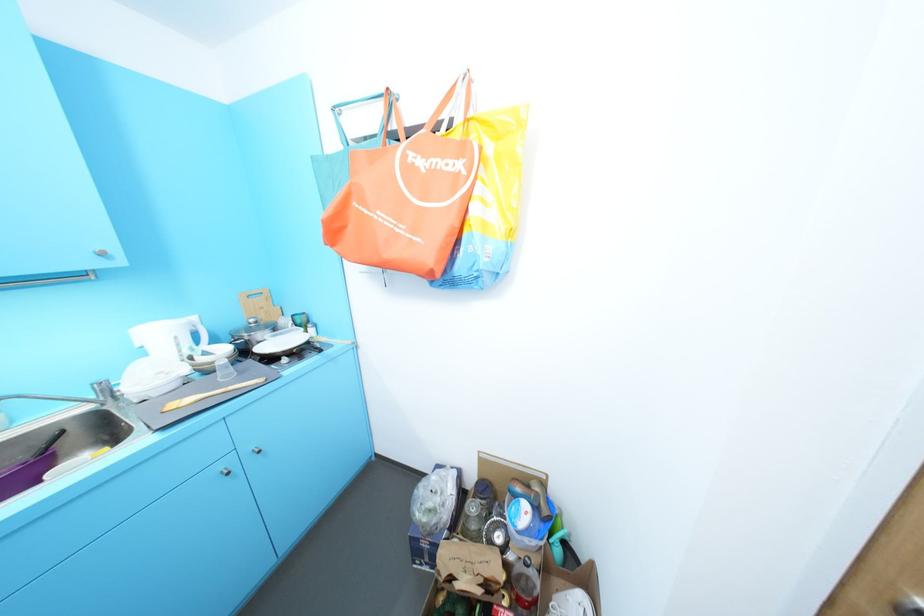
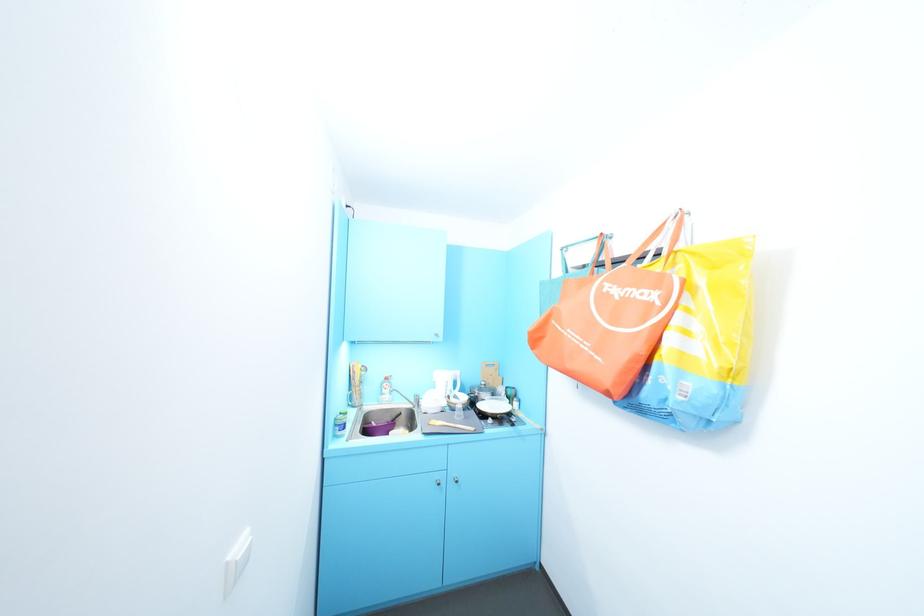
Where in the second image is the point corresponding to [248,373] from the first image?

(472, 418)